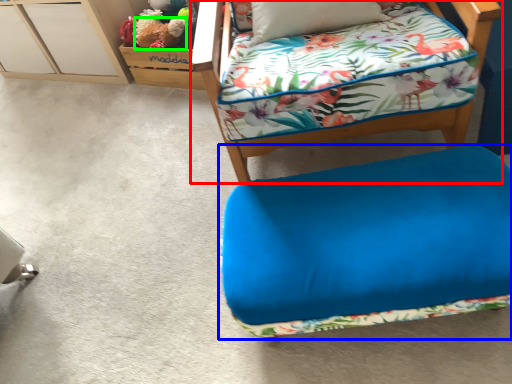
Question: Estimate the real-world distances between objects in this image. Which object is closer to furniture (highlighted by a red box), furniture (highlighted by a blue box) or animal (highlighted by a green box)?

Choices:
 (A) furniture
 (B) animal

Answer: (A)